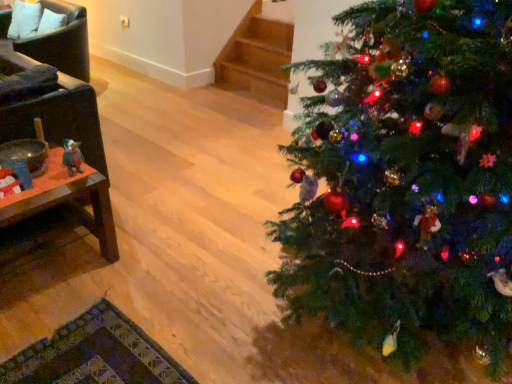
Question: Is leather armchair at left, positioned as the first armchair in top-to-bottom order, to the left of green matte christmas tree at right from the viewer's perspective?

Choices:
 (A) no
 (B) yes

Answer: (B)

Question: Considering the relative sizes of leather armchair at left, the 2th armchair positioned from the front, and green matte christmas tree at right in the image provided, is leather armchair at left, the 2th armchair positioned from the front, taller than green matte christmas tree at right?

Choices:
 (A) yes
 (B) no

Answer: (B)

Question: Does leather armchair at left, positioned as the first armchair in top-to-bottom order, lie in front of green matte christmas tree at right?

Choices:
 (A) yes
 (B) no

Answer: (B)

Question: Can you confirm if leather armchair at left, which ranks as the second armchair in bottom-to-top order, is positioned to the right of green matte christmas tree at right?

Choices:
 (A) yes
 (B) no

Answer: (B)

Question: From the image's perspective, is leather armchair at left, positioned as the first armchair in top-to-bottom order, on top of green matte christmas tree at right?

Choices:
 (A) yes
 (B) no

Answer: (A)

Question: Is woodenmaterial/texturetable at left inside or outside of white fabric pillow at upper left?

Choices:
 (A) inside
 (B) outside

Answer: (B)

Question: Looking at their shapes, would you say woodenmaterial/texturetable at left is wider or thinner than white fabric pillow at upper left?

Choices:
 (A) thin
 (B) wide

Answer: (B)

Question: From the image's perspective, is woodenmaterial/texturetable at left above or below white fabric pillow at upper left?

Choices:
 (A) above
 (B) below

Answer: (B)

Question: Would you say woodenmaterial/texturetable at left is to the left or to the right of white fabric pillow at upper left in the picture?

Choices:
 (A) right
 (B) left

Answer: (A)

Question: Is woodenmaterial/texturetable at left in front of or behind green matte christmas tree at right in the image?

Choices:
 (A) behind
 (B) front

Answer: (A)

Question: From a real-world perspective, is woodenmaterial/texturetable at left physically located above or below green matte christmas tree at right?

Choices:
 (A) below
 (B) above

Answer: (A)

Question: From the image's perspective, relative to green matte christmas tree at right, is woodenmaterial/texturetable at left above or below?

Choices:
 (A) below
 (B) above

Answer: (A)

Question: Is woodenmaterial/texturetable at left situated inside green matte christmas tree at right or outside?

Choices:
 (A) outside
 (B) inside

Answer: (A)

Question: Considering the positions of point (65, 140) and point (33, 31), is point (65, 140) closer or farther from the camera than point (33, 31)?

Choices:
 (A) closer
 (B) farther

Answer: (A)

Question: In terms of width, does green plush toy at left look wider or thinner when compared to white fabric pillow at upper left?

Choices:
 (A) wide
 (B) thin

Answer: (B)